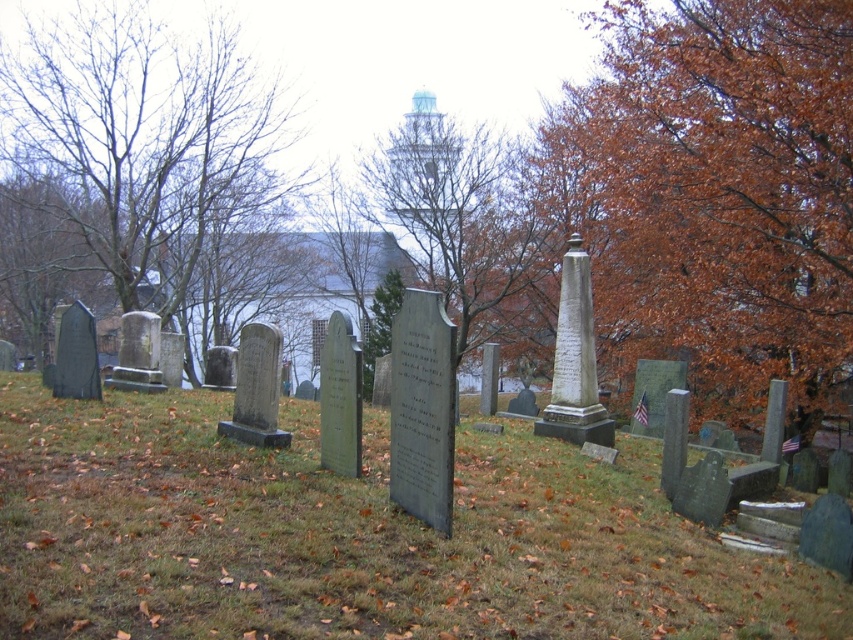
Question: Which of the following is the closest to the observer?

Choices:
 (A) (370, 515)
 (B) (140, 161)

Answer: (A)

Question: Does brown leafy tree at center right appear over brown leafy tree at center?

Choices:
 (A) yes
 (B) no

Answer: (A)

Question: Does green grass at center appear on the right side of brown leafy tree at center?

Choices:
 (A) no
 (B) yes

Answer: (B)

Question: Does bare branches at left have a lesser width compared to brown leafy tree at center?

Choices:
 (A) no
 (B) yes

Answer: (B)

Question: Which object is closer to the camera taking this photo?

Choices:
 (A) bare branches at left
 (B) brown leafy tree at center

Answer: (B)

Question: Which object appears closest to the camera in this image?

Choices:
 (A) brown leafy tree at center
 (B) green grass at center
 (C) brown leafy tree at center right

Answer: (B)